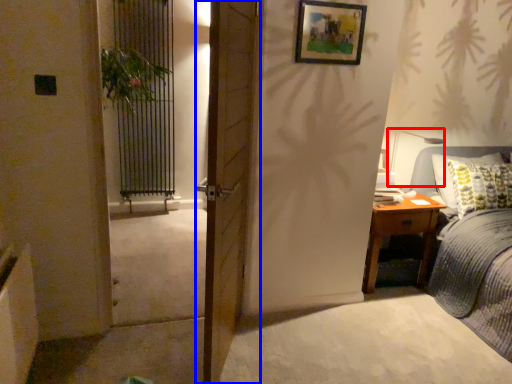
Question: Among these objects, which one is farthest to the camera, table lamp (highlighted by a red box) or door (highlighted by a blue box)?

Choices:
 (A) table lamp
 (B) door

Answer: (A)